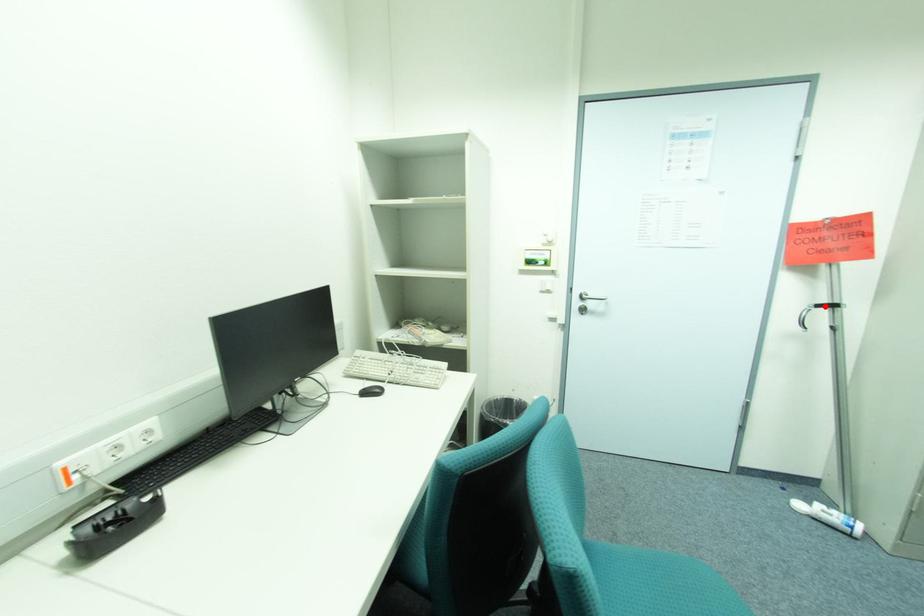
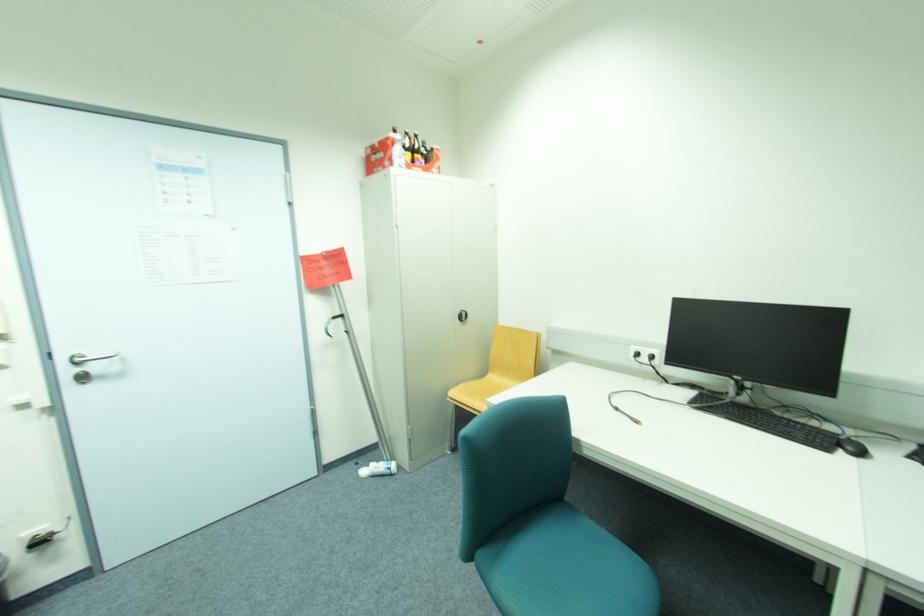
Locate, in the second image, the point that corresponds to the highlighted location in the first image.

(339, 317)